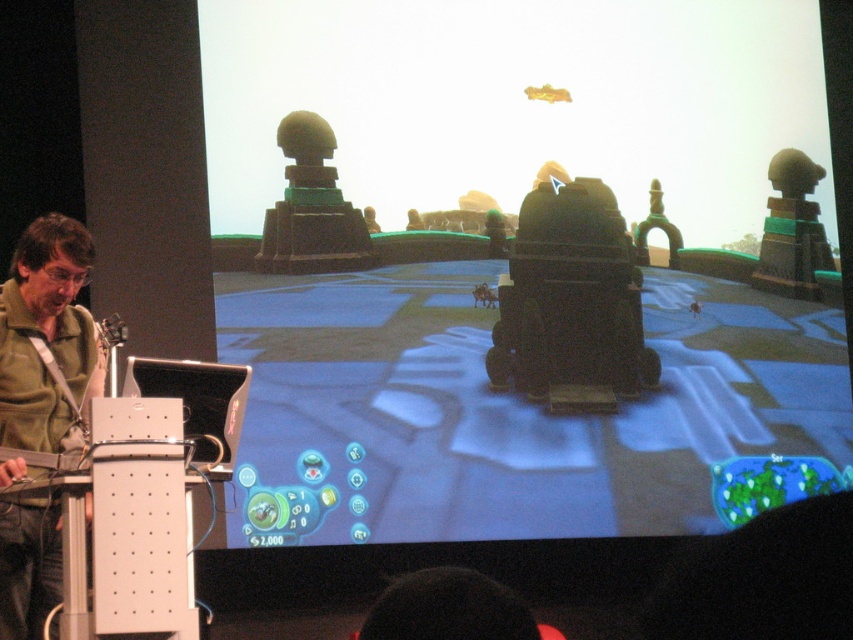
Can you confirm if matte black projector screen at center is positioned to the left of green matte shirt at left?

No, matte black projector screen at center is not to the left of green matte shirt at left.

What do you see at coordinates (525, 266) in the screenshot? The width and height of the screenshot is (853, 640). I see `matte black projector screen at center` at bounding box center [525, 266].

Find the location of `matte black projector screen at center`. matte black projector screen at center is located at coordinates (525, 266).